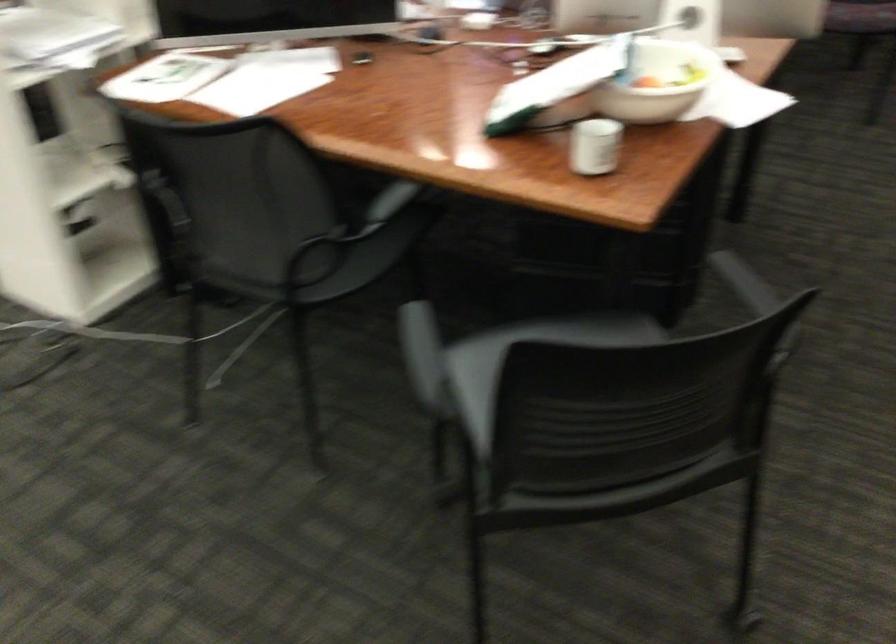
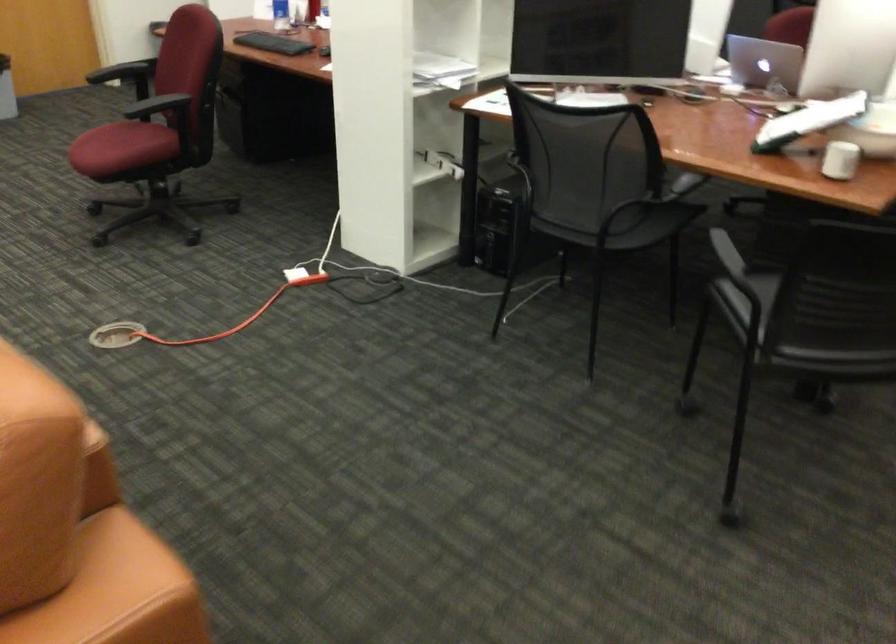
Find the pixel in the second image that matches [100,172] in the first image.

(444, 163)